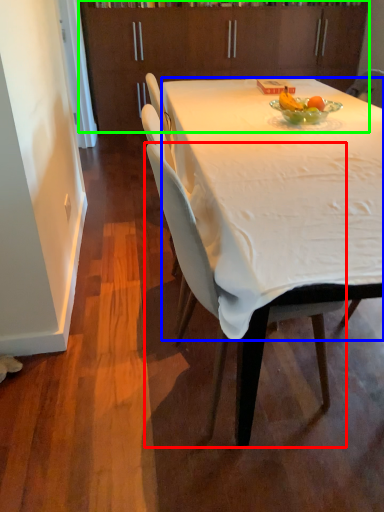
Question: Estimate the real-world distances between objects in this image. Which object is closer to chair (highlighted by a red box), desk (highlighted by a blue box) or cabinetry (highlighted by a green box)?

Choices:
 (A) desk
 (B) cabinetry

Answer: (A)